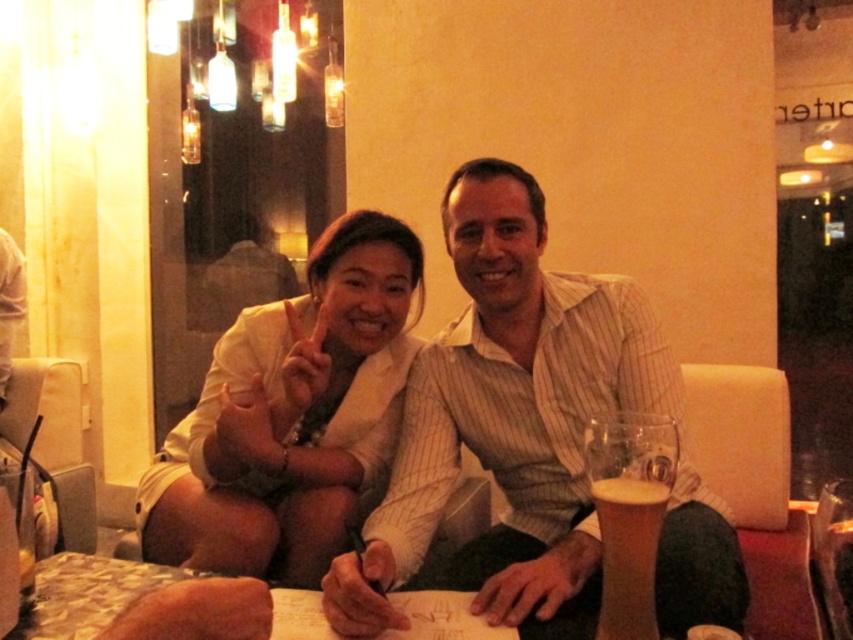
Does white striped shirt at center appear over foamy glass beer at lower right?

Yes, white striped shirt at center is above foamy glass beer at lower right.

I want to click on white striped shirt at center, so click(532, 436).

Which is behind, point (328, 422) or point (613, 481)?

The point (328, 422) is behind.

Is point (379, 426) farther from viewer compared to point (608, 636)?

Yes, it is.

Is point (223, 346) less distant than point (602, 552)?

No, (223, 346) is further to viewer.

You are a GUI agent. You are given a task and a screenshot of the screen. Output one action in this format:
    pyautogui.click(x=<x>, y=<y>)
    Task: Click on the white textured blouse at center
    
    Given the screenshot: What is the action you would take?
    pyautogui.click(x=294, y=416)

Does golden frothy beer at lower right have a lesser width compared to foamy glass beer at lower right?

Yes, golden frothy beer at lower right is thinner than foamy glass beer at lower right.

Locate an element on the screen. The height and width of the screenshot is (640, 853). golden frothy beer at lower right is located at coordinates (628, 554).